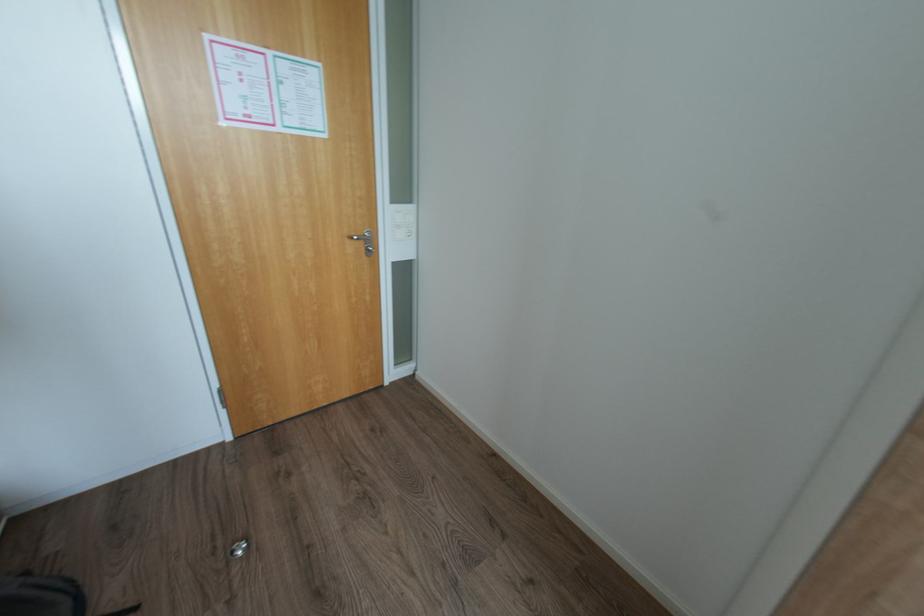
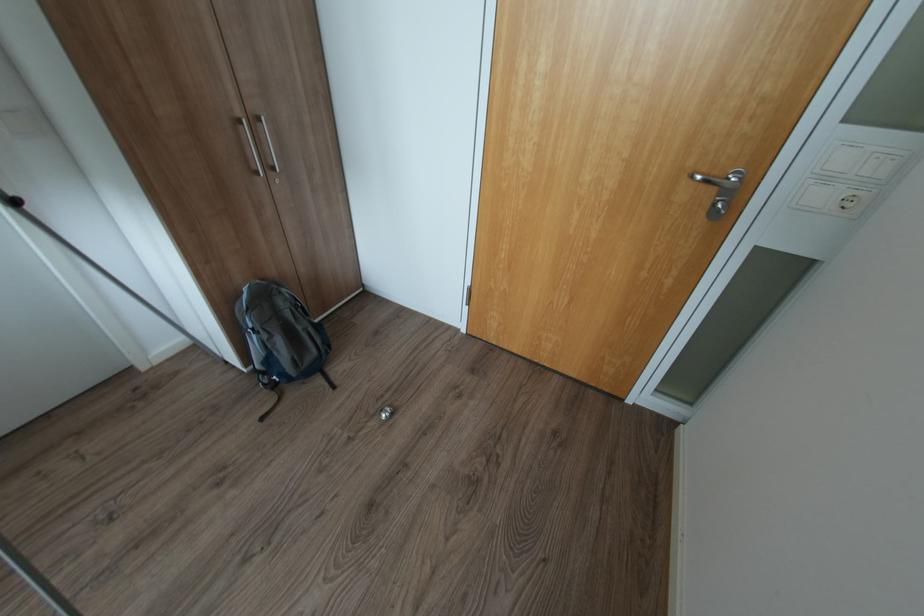
The first image is from the beginning of the video and the second image is from the end. How did the camera likely rotate when shooting the video?

The rotation direction of the camera is left-down.